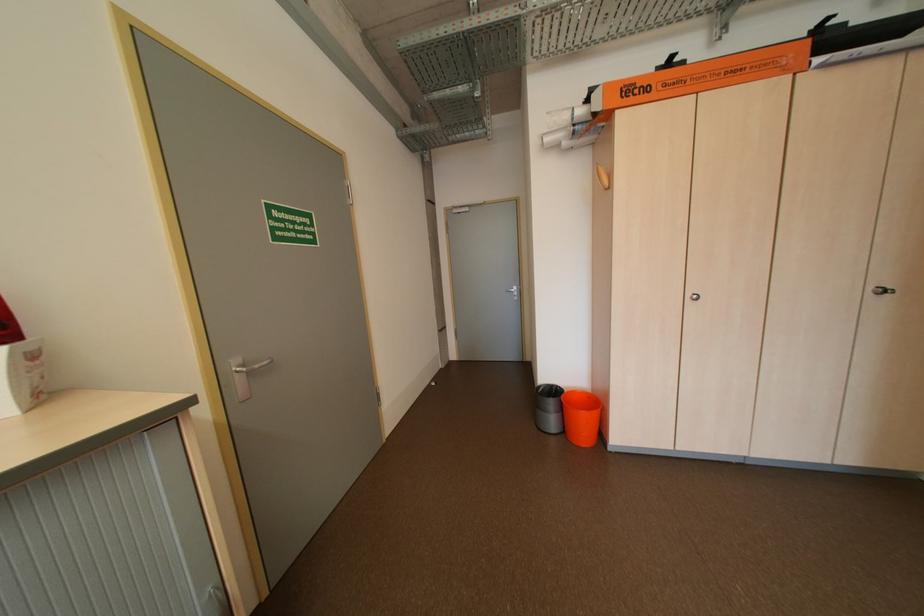
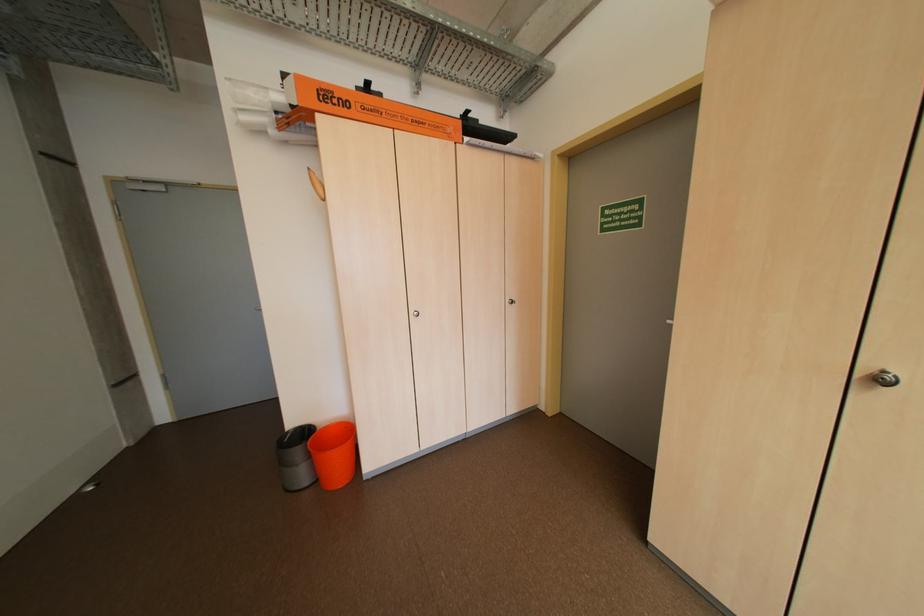
The point at (561, 403) is marked in the first image. Where is the corresponding point in the second image?

(307, 453)